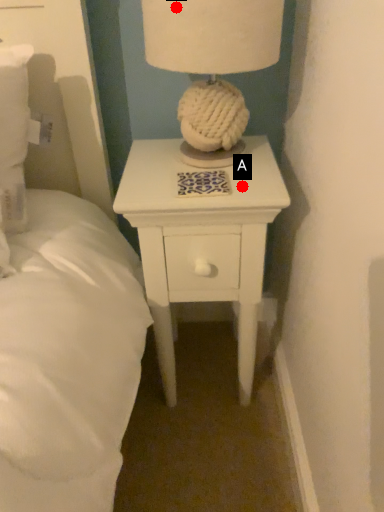
Question: Two points are circled on the image, labeled by A and B beside each circle. Among these points, which one is nearest to the camera?

Choices:
 (A) A is closer
 (B) B is closer

Answer: (B)